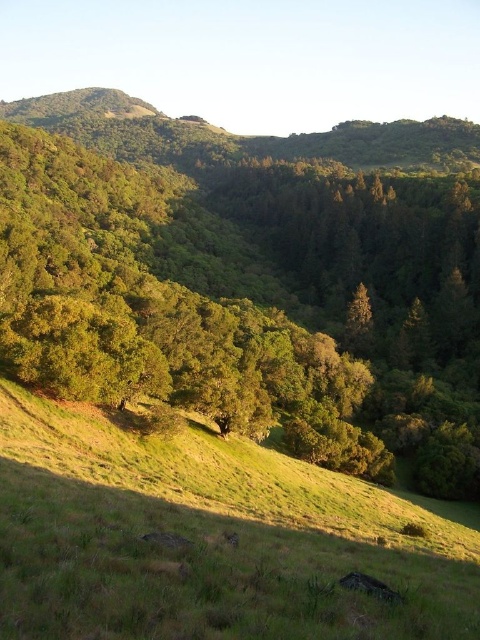
Question: Which point appears closest to the camera in this image?

Choices:
 (A) click(158, 356)
 (B) click(160, 580)

Answer: (B)

Question: Which point is farther to the camera?

Choices:
 (A) green leafy tree at center
 (B) green grassy hillside at lower center

Answer: (A)

Question: Is green leafy tree at center to the right of green grassy hillside at lower center from the viewer's perspective?

Choices:
 (A) yes
 (B) no

Answer: (B)

Question: Does green leafy tree at center have a greater width compared to green grassy hillside at lower center?

Choices:
 (A) no
 (B) yes

Answer: (B)

Question: Does green leafy tree at center have a smaller size compared to green grassy hillside at lower center?

Choices:
 (A) no
 (B) yes

Answer: (A)